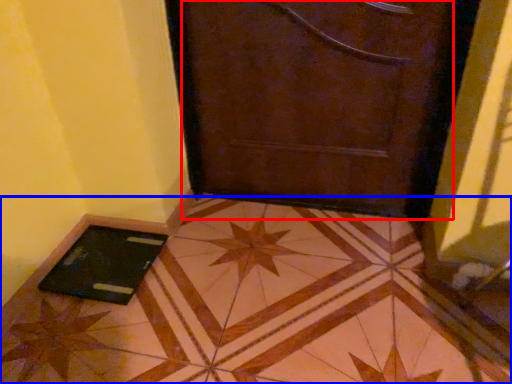
Question: Which point is further to the camera, door (highlighted by a red box) or tile (highlighted by a blue box)?

Choices:
 (A) door
 (B) tile

Answer: (A)